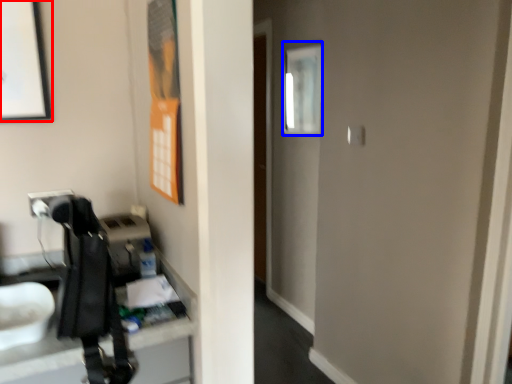
Question: Which object appears farthest to the camera in this image, picture frame (highlighted by a red box) or mirror (highlighted by a blue box)?

Choices:
 (A) picture frame
 (B) mirror

Answer: (B)